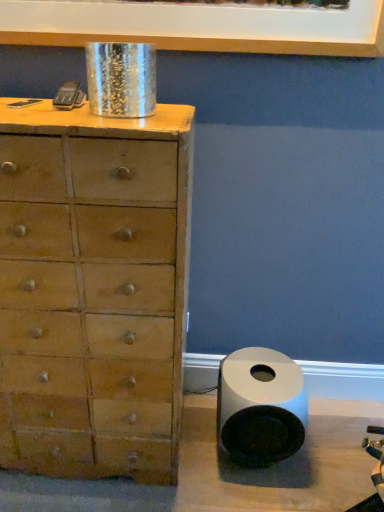
This screenshot has width=384, height=512. Find the location of `wooden chest of drawers at left`. wooden chest of drawers at left is located at coordinates (93, 290).

What do you see at coordinates (198, 27) in the screenshot? The width and height of the screenshot is (384, 512). I see `white glossy picture frame at upper center` at bounding box center [198, 27].

The height and width of the screenshot is (512, 384). I want to click on white glossy speaker at lower right, so click(x=260, y=406).

Is white glossy picture frame at upper center oriented away from white glossy speaker at lower right?

white glossy picture frame at upper center is not turned away from white glossy speaker at lower right.

In the scene shown: Is the surface of white glossy picture frame at upper center in direct contact with white glossy speaker at lower right?

No, white glossy picture frame at upper center is not making contact with white glossy speaker at lower right.

The width and height of the screenshot is (384, 512). In order to click on speaker below the white glossy picture frame at upper center (from the image's perspective) in this screenshot , I will do `click(260, 406)`.

Could you measure the distance between white glossy picture frame at upper center and white glossy speaker at lower right?

The distance of white glossy picture frame at upper center from white glossy speaker at lower right is 3.39 feet.

Is white glossy speaker at lower right completely or partially outside of white glossy picture frame at upper center?

Yes, white glossy speaker at lower right is not within white glossy picture frame at upper center.

Is white glossy speaker at lower right bigger than white glossy picture frame at upper center?

Indeed, white glossy speaker at lower right has a larger size compared to white glossy picture frame at upper center.

Is point (231, 441) farther from viewer compared to point (380, 27)?

Yes, point (231, 441) is farther from viewer.

Are white glossy speaker at lower right and wooden chest of drawers at left making contact?

No, white glossy speaker at lower right is not in contact with wooden chest of drawers at left.

From the image's perspective, which is above, white glossy speaker at lower right or wooden chest of drawers at left?

wooden chest of drawers at left appears higher in the image.

Locate an element on the screen. The image size is (384, 512). the chest of drawers that is above the white glossy speaker at lower right (from the image's perspective) is located at coordinates (93, 290).

Would you say white glossy speaker at lower right is inside or outside wooden chest of drawers at left?

white glossy speaker at lower right is outside wooden chest of drawers at left.

Is wooden chest of drawers at left next to white glossy picture frame at upper center?

wooden chest of drawers at left and white glossy picture frame at upper center are clearly separated.

From the image's perspective, relative to white glossy picture frame at upper center, is wooden chest of drawers at left above or below?

Clearly, from the image's perspective, wooden chest of drawers at left is below white glossy picture frame at upper center.

Consider the image. Is wooden chest of drawers at left aimed at white glossy picture frame at upper center?

No, wooden chest of drawers at left is not oriented towards white glossy picture frame at upper center.

Which is nearer, (33, 266) or (309, 22)?

The point (33, 266) is more forward.

Can you confirm if white glossy picture frame at upper center is wider than wooden chest of drawers at left?

Incorrect, the width of white glossy picture frame at upper center does not surpass that of wooden chest of drawers at left.

Measure the distance between white glossy picture frame at upper center and wooden chest of drawers at left.

white glossy picture frame at upper center is 68.25 centimeters from wooden chest of drawers at left.

Who is taller, white glossy picture frame at upper center or wooden chest of drawers at left?

Standing taller between the two is wooden chest of drawers at left.

From the image's perspective, is white glossy picture frame at upper center on wooden chest of drawers at left?

Indeed, from the image's perspective, white glossy picture frame at upper center is shown above wooden chest of drawers at left.

Locate an element on the screen. the chest of drawers located above the white glossy speaker at lower right (from the image's perspective) is located at coordinates (93, 290).

Is wooden chest of drawers at left far away from white glossy speaker at lower right?

wooden chest of drawers at left is near white glossy speaker at lower right, not far away.

Considering the sizes of objects wooden chest of drawers at left and white glossy speaker at lower right in the image provided, who is thinner, wooden chest of drawers at left or white glossy speaker at lower right?

white glossy speaker at lower right.

This screenshot has width=384, height=512. Identify the location of speaker below the white glossy picture frame at upper center (from the image's perspective). (260, 406).

I want to click on picture frame above the white glossy speaker at lower right (from the image's perspective), so click(x=198, y=27).

From the image, which object appears to be nearer to white glossy speaker at lower right, wooden chest of drawers at left or white glossy picture frame at upper center?

wooden chest of drawers at left is closer to white glossy speaker at lower right.

Estimate the real-world distances between objects in this image. Which object is closer to white glossy picture frame at upper center, wooden chest of drawers at left or white glossy speaker at lower right?

Based on the image, wooden chest of drawers at left appears to be nearer to white glossy picture frame at upper center.

When comparing their distances from wooden chest of drawers at left, does white glossy speaker at lower right or white glossy picture frame at upper center seem further?

Among the two, white glossy picture frame at upper center is located further to wooden chest of drawers at left.

When comparing their distances from wooden chest of drawers at left, does white glossy picture frame at upper center or white glossy speaker at lower right seem further?

The object further to wooden chest of drawers at left is white glossy picture frame at upper center.

Looking at the image, which one is located closer to white glossy speaker at lower right, white glossy picture frame at upper center or wooden chest of drawers at left?

Among the two, wooden chest of drawers at left is located nearer to white glossy speaker at lower right.

Estimate the real-world distances between objects in this image. Which object is further from white glossy picture frame at upper center, white glossy speaker at lower right or wooden chest of drawers at left?

white glossy speaker at lower right lies further to white glossy picture frame at upper center than the other object.

Locate an element on the screen. Image resolution: width=384 pixels, height=512 pixels. the chest of drawers between white glossy picture frame at upper center and white glossy speaker at lower right vertically is located at coordinates (93, 290).